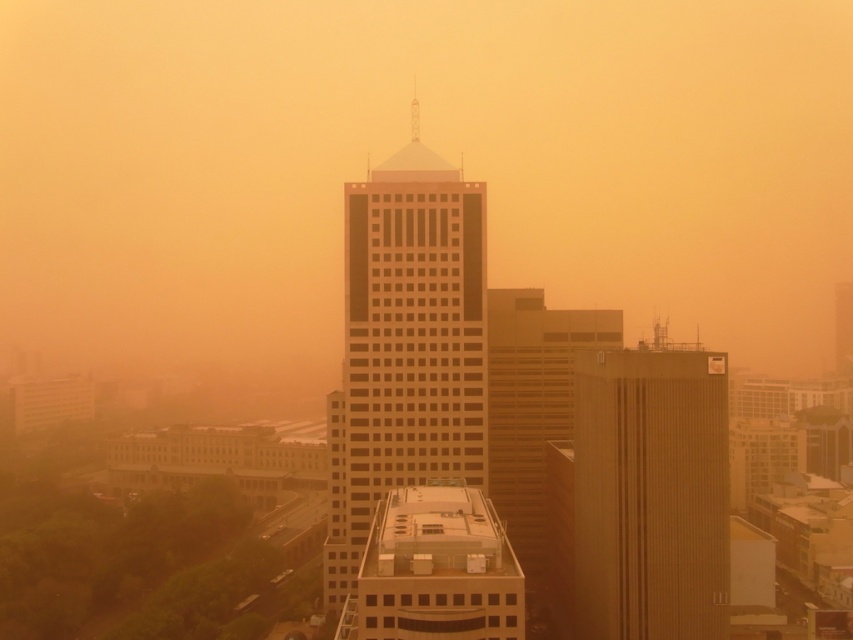
Question: Which point is farther from the camera taking this photo?

Choices:
 (A) (817, 323)
 (B) (587, 589)

Answer: (A)

Question: Which point is farther to the camera?

Choices:
 (A) matte orange haze at center
 (B) brown textured building at center
 (C) matte glass skyscraper at center

Answer: (A)

Question: Which object is farther from the camera taking this photo?

Choices:
 (A) matte glass skyscraper at center
 (B) matte orange haze at center

Answer: (B)

Question: Does matte orange haze at center appear on the right side of matte glass skyscraper at center?

Choices:
 (A) no
 (B) yes

Answer: (B)

Question: Can you confirm if matte orange haze at center is positioned to the left of brown textured building at center?

Choices:
 (A) yes
 (B) no

Answer: (A)

Question: Is matte glass skyscraper at center closer to camera compared to brown textured building at center?

Choices:
 (A) no
 (B) yes

Answer: (A)